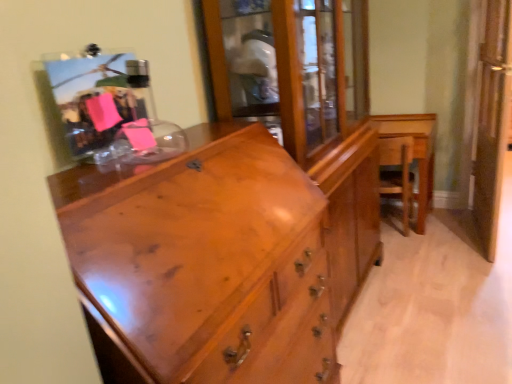
Question: Is wooden armchair at right behind wooden table at right?

Choices:
 (A) no
 (B) yes

Answer: (B)

Question: Would you say wooden table at right is part of wooden armchair at right's contents?

Choices:
 (A) yes
 (B) no

Answer: (B)

Question: Does wooden armchair at right have a larger size compared to wooden table at right?

Choices:
 (A) yes
 (B) no

Answer: (B)

Question: From the image's perspective, does wooden armchair at right appear lower than wooden table at right?

Choices:
 (A) no
 (B) yes

Answer: (B)

Question: Is wooden armchair at right positioned far away from wooden table at right?

Choices:
 (A) yes
 (B) no

Answer: (B)

Question: Is clear glass screen door at right wider or thinner than shiny brown wood chest of drawers at center?

Choices:
 (A) wide
 (B) thin

Answer: (B)

Question: From a real-world perspective, is clear glass screen door at right positioned above or below shiny brown wood chest of drawers at center?

Choices:
 (A) below
 (B) above

Answer: (B)

Question: Considering the positions of point (503, 24) and point (233, 216), is point (503, 24) closer or farther from the camera than point (233, 216)?

Choices:
 (A) farther
 (B) closer

Answer: (A)

Question: From the image's perspective, is clear glass screen door at right located above or below shiny brown wood chest of drawers at center?

Choices:
 (A) below
 (B) above

Answer: (B)

Question: Is wooden armchair at right taller or shorter than clear glass screen door at right?

Choices:
 (A) tall
 (B) short

Answer: (B)

Question: In the image, is wooden armchair at right on the left side or the right side of clear glass screen door at right?

Choices:
 (A) right
 (B) left

Answer: (B)

Question: Does point (400, 170) appear closer or farther from the camera than point (486, 241)?

Choices:
 (A) farther
 (B) closer

Answer: (A)

Question: Is wooden armchair at right inside or outside of clear glass screen door at right?

Choices:
 (A) outside
 (B) inside

Answer: (A)

Question: Is wooden armchair at right wider or thinner than shiny brown wood chest of drawers at center?

Choices:
 (A) thin
 (B) wide

Answer: (A)

Question: From the image's perspective, is wooden armchair at right above or below shiny brown wood chest of drawers at center?

Choices:
 (A) above
 (B) below

Answer: (A)